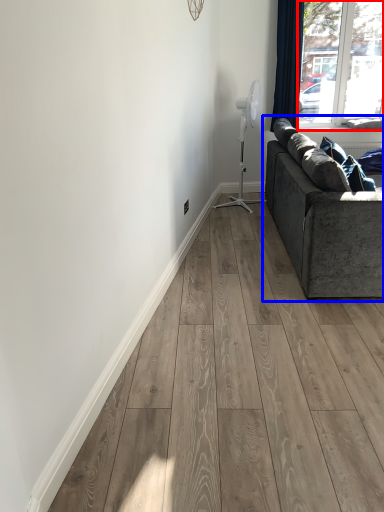
Question: Which object appears closest to the camera in this image, window (highlighted by a red box) or studio couch (highlighted by a blue box)?

Choices:
 (A) window
 (B) studio couch

Answer: (B)